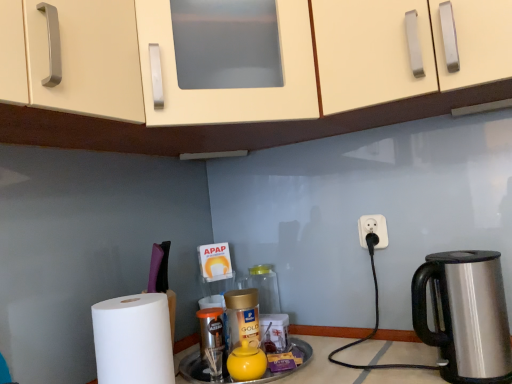
Question: Can you confirm if yellow matte tea pot at center is smaller than stainless steel kettle at right?

Choices:
 (A) yes
 (B) no

Answer: (A)

Question: Is stainless steel kettle at right a part of yellow matte tea pot at center?

Choices:
 (A) no
 (B) yes

Answer: (A)

Question: From a real-world perspective, is yellow matte tea pot at center under stainless steel kettle at right?

Choices:
 (A) yes
 (B) no

Answer: (A)

Question: From the image's perspective, does yellow matte tea pot at center appear higher than stainless steel kettle at right?

Choices:
 (A) yes
 (B) no

Answer: (B)

Question: Considering the relative positions of yellow matte tea pot at center and stainless steel kettle at right in the image provided, is yellow matte tea pot at center to the right of stainless steel kettle at right from the viewer's perspective?

Choices:
 (A) yes
 (B) no

Answer: (B)

Question: In terms of width, does yellow matte tea pot at center look wider or thinner when compared to matte cream cabinet at upper center?

Choices:
 (A) wide
 (B) thin

Answer: (B)

Question: From the image's perspective, relative to matte cream cabinet at upper center, is yellow matte tea pot at center above or below?

Choices:
 (A) above
 (B) below

Answer: (B)

Question: Based on their positions, is yellow matte tea pot at center located to the left or right of matte cream cabinet at upper center?

Choices:
 (A) left
 (B) right

Answer: (A)

Question: Is yellow matte tea pot at center spatially inside matte cream cabinet at upper center, or outside of it?

Choices:
 (A) outside
 (B) inside

Answer: (A)

Question: Considering the relative positions of matte cream cabinet at upper center and gold plastic bottle at center, which ranks as the 1th bottle in front-to-back order, in the image provided, is matte cream cabinet at upper center to the left or to the right of gold plastic bottle at center, which ranks as the 1th bottle in front-to-back order,?

Choices:
 (A) left
 (B) right

Answer: (B)

Question: Is point (398, 26) closer or farther from the camera than point (232, 296)?

Choices:
 (A) closer
 (B) farther

Answer: (A)

Question: In the image, is matte cream cabinet at upper center positioned in front of or behind gold plastic bottle at center, which is the second bottle in back-to-front order?

Choices:
 (A) front
 (B) behind

Answer: (A)

Question: Looking at the image, does matte cream cabinet at upper center seem bigger or smaller compared to gold plastic bottle at center, which is the second bottle in back-to-front order?

Choices:
 (A) big
 (B) small

Answer: (A)

Question: From the image's perspective, is stainless steel kettle at right located above or below gold metallic jar at center, positioned as the 2th bottle in front-to-back order?

Choices:
 (A) below
 (B) above

Answer: (B)

Question: Considering the positions of point pyautogui.click(x=498, y=312) and point pyautogui.click(x=264, y=299), is point pyautogui.click(x=498, y=312) closer or farther from the camera than point pyautogui.click(x=264, y=299)?

Choices:
 (A) farther
 (B) closer

Answer: (B)